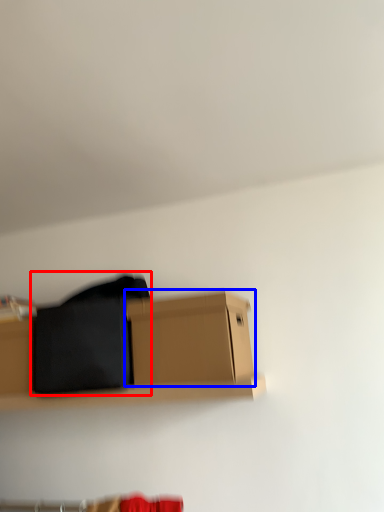
Question: Which object appears farthest to the camera in this image, clothing (highlighted by a red box) or box (highlighted by a blue box)?

Choices:
 (A) clothing
 (B) box

Answer: (A)